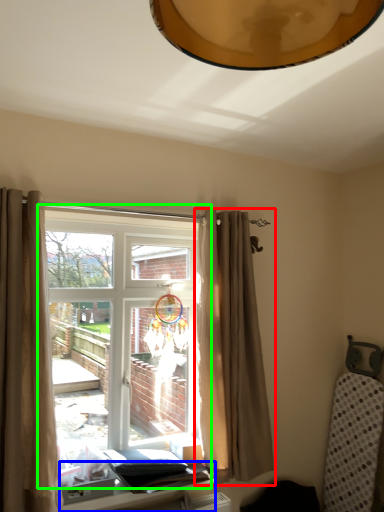
Question: Which object is positioned closest to curtain (highlighted by a red box)? Select from table (highlighted by a blue box) and window (highlighted by a green box).

Choices:
 (A) table
 (B) window

Answer: (B)